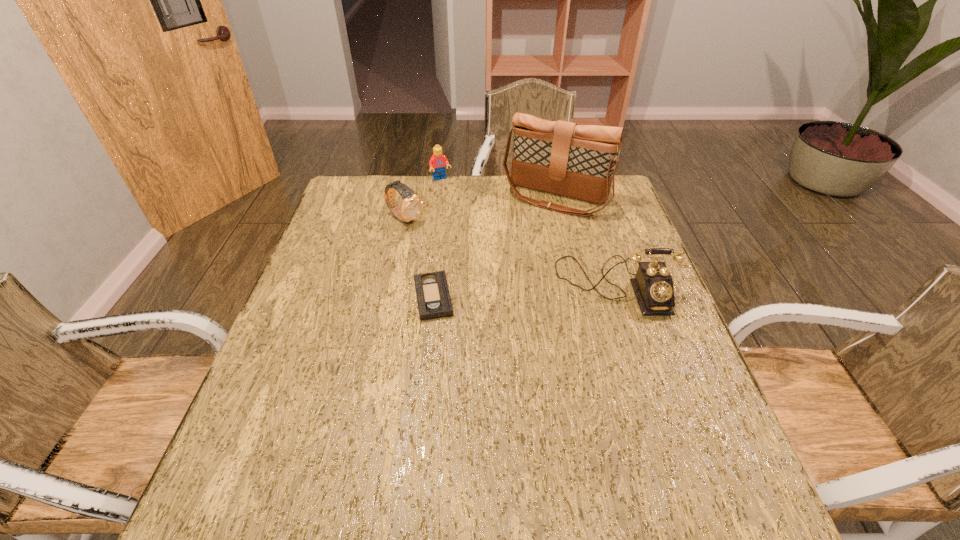
At what (x,y) coordinates should I click in order to perform the action: click on vacant point located between the watch and the telephone. Please return your answer as a coordinate pair (x, y). Looking at the image, I should click on pyautogui.click(x=510, y=252).

You are a GUI agent. You are given a task and a screenshot of the screen. Output one action in this format:
    pyautogui.click(x=<x>, y=<y>)
    Task: Click on the free space between the Lego and the telephone
    The image size is (960, 540).
    Given the screenshot: What is the action you would take?
    pyautogui.click(x=528, y=232)

Locate an element on the screen. This screenshot has height=540, width=960. empty space that is in between the shoulder bag and the videotape is located at coordinates (494, 247).

In order to click on vacant area that lies between the videotape and the Lego in this screenshot , I will do `click(437, 238)`.

You are a GUI agent. You are given a task and a screenshot of the screen. Output one action in this format:
    pyautogui.click(x=<x>, y=<y>)
    Task: Click on the vacant area that lies between the telephone and the Lego
    This screenshot has width=960, height=540.
    Given the screenshot: What is the action you would take?
    pyautogui.click(x=528, y=232)

You are a GUI agent. You are given a task and a screenshot of the screen. Output one action in this format:
    pyautogui.click(x=<x>, y=<y>)
    Task: Click on the free spot between the watch and the telephone
    Image resolution: width=960 pixels, height=540 pixels.
    Given the screenshot: What is the action you would take?
    pyautogui.click(x=510, y=252)

This screenshot has width=960, height=540. Identify the location of vacant area between the telephone and the videotape. (524, 291).

The height and width of the screenshot is (540, 960). In order to click on free spot between the watch and the Lego in this screenshot , I will do `click(422, 199)`.

Find the location of a particular element. The image size is (960, 540). empty space between the tallest object and the Lego is located at coordinates (498, 188).

Locate an element on the screen. object that is the second closest to the telephone is located at coordinates (433, 298).